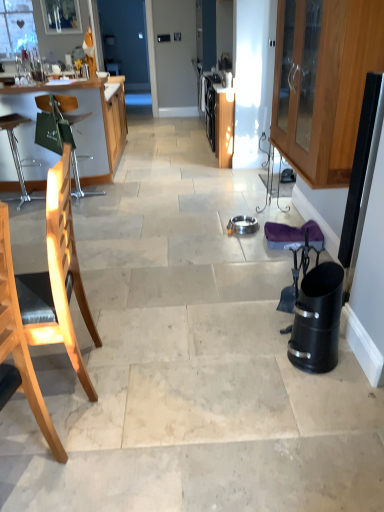
Where is `free space to the left of black plastic trash can at right`? Image resolution: width=384 pixels, height=512 pixels. free space to the left of black plastic trash can at right is located at coordinates (267, 360).